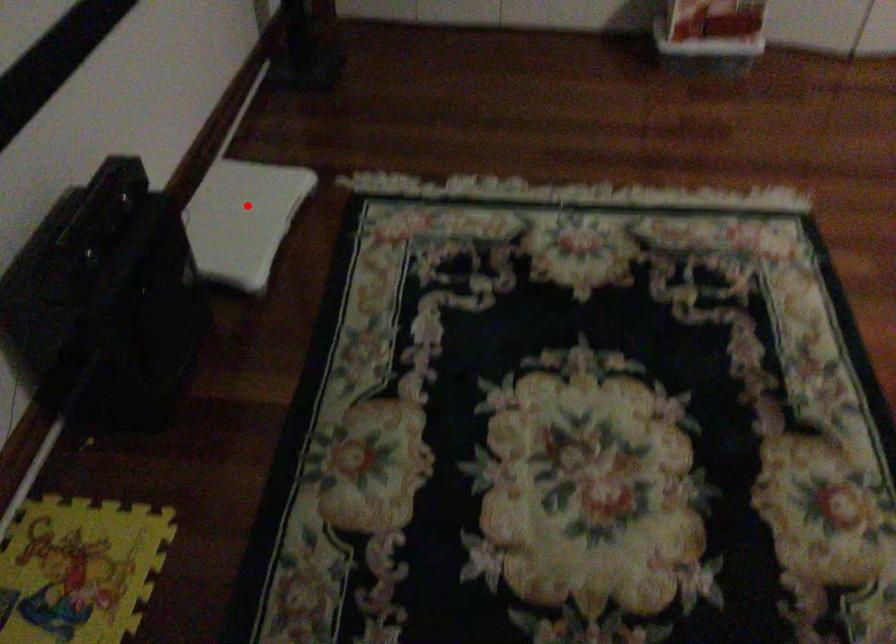
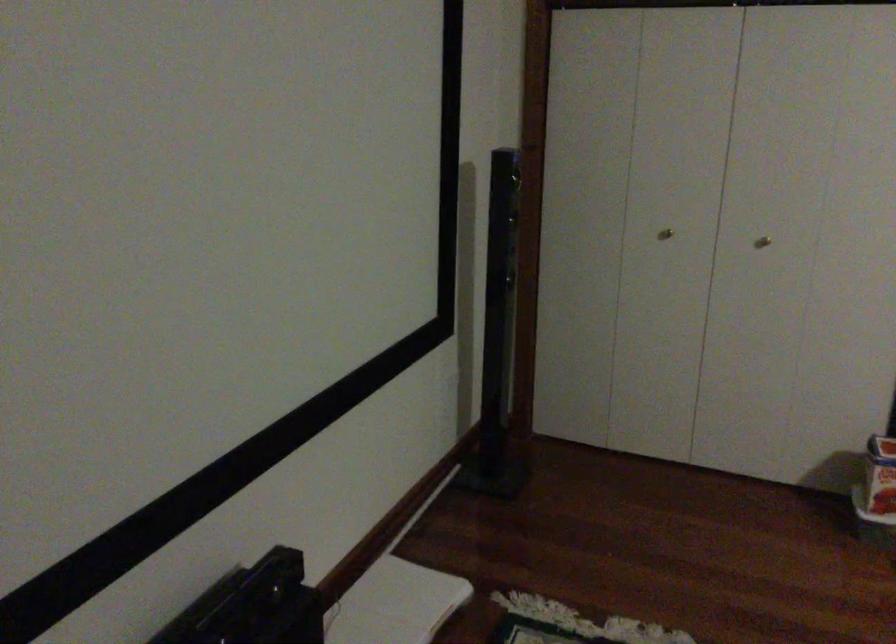
The point at the highlighted location is marked in the first image. Where is the corresponding point in the second image?

(394, 603)